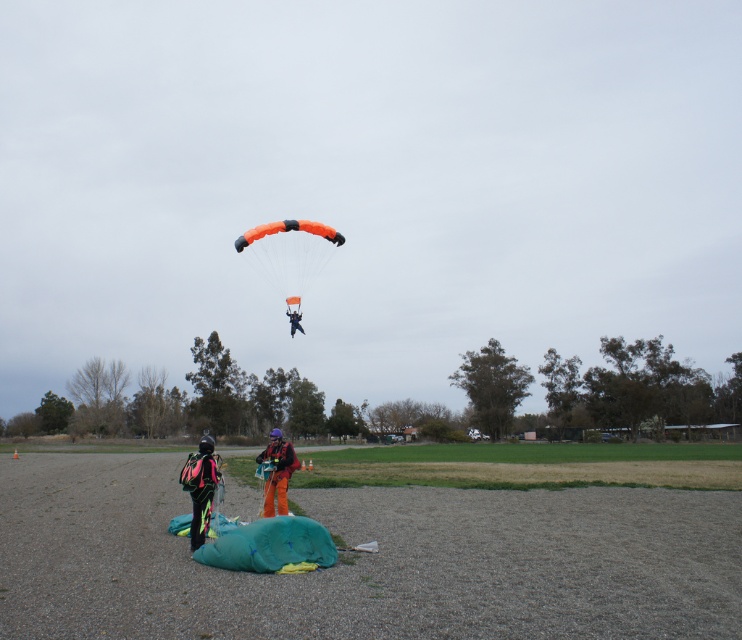
Question: Is orange matte parachute at center to the right of orange fabric parachute at center from the viewer's perspective?

Choices:
 (A) yes
 (B) no

Answer: (B)

Question: Is orange matte parachute at center smaller than orange fabric parachute at center?

Choices:
 (A) yes
 (B) no

Answer: (B)

Question: Does neon yellow fabric wingsuit at lower left appear on the left side of orange fabric parachute at upper center?

Choices:
 (A) yes
 (B) no

Answer: (A)

Question: Which point appears farthest from the camera in this image?

Choices:
 (A) (321, 236)
 (B) (275, 484)
 (C) (295, 314)

Answer: (A)

Question: Which of the following is the closest to the observer?

Choices:
 (A) (285, 451)
 (B) (301, 291)
 (C) (292, 326)

Answer: (A)

Question: Which object is positioned closest to the orange fabric parachute at center?

Choices:
 (A) neon yellow fabric wingsuit at lower left
 (B) orange matte parachute at center
 (C) orange fabric parachute at upper center

Answer: (A)